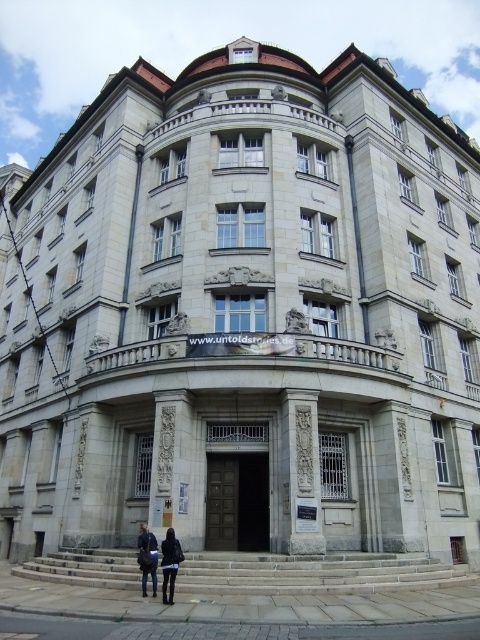
Where is `dark blue leather jacket at lower center`? The width and height of the screenshot is (480, 640). dark blue leather jacket at lower center is located at coordinates (169, 563).

Between dark blue leather jacket at lower center and dark blue jeans at lower center, which one appears on the right side from the viewer's perspective?

Positioned to the right is dark blue leather jacket at lower center.

Who is more forward, (164,604) or (156,582)?

Point (164,604)

At what (x,y) coordinates should I click in order to perform the action: click on dark blue leather jacket at lower center. Please return your answer as a coordinate pair (x, y). Looking at the image, I should click on (169, 563).

Does dark wood door at center have a greater height compared to dark blue leather jacket at lower center?

Correct, dark wood door at center is much taller as dark blue leather jacket at lower center.

Who is lower down, dark wood door at center or dark blue leather jacket at lower center?

dark wood door at center is lower down.

What do you see at coordinates (237, 500) in the screenshot? Image resolution: width=480 pixels, height=640 pixels. I see `dark wood door at center` at bounding box center [237, 500].

The height and width of the screenshot is (640, 480). What are the coordinates of `dark wood door at center` in the screenshot? It's located at (237, 500).

Is dark wood door at center to the left of dark blue jeans at lower center from the viewer's perspective?

No, dark wood door at center is not to the left of dark blue jeans at lower center.

Between dark wood door at center and dark blue jeans at lower center, which one appears on the left side from the viewer's perspective?

Positioned to the left is dark blue jeans at lower center.

Locate an element on the screen. The image size is (480, 640). dark wood door at center is located at coordinates (237, 500).